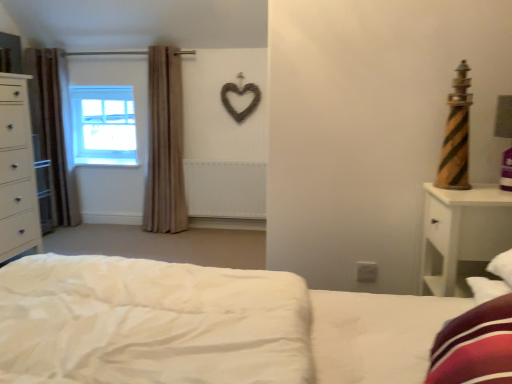
Question: Is white wood nightstand at right far away from beige fabric curtain at left, the second curtain positioned from the left?

Choices:
 (A) no
 (B) yes

Answer: (B)

Question: Does white wood nightstand at right appear on the right side of beige fabric curtain at left, the second curtain positioned from the left?

Choices:
 (A) no
 (B) yes

Answer: (B)

Question: Is the position of white wood nightstand at right more distant than that of beige fabric curtain at left, which ranks as the 1th curtain in right-to-left order?

Choices:
 (A) no
 (B) yes

Answer: (A)

Question: Is beige fabric curtain at left, which ranks as the 1th curtain in right-to-left order, surrounded by white wood nightstand at right?

Choices:
 (A) no
 (B) yes

Answer: (A)

Question: Can you confirm if white wood nightstand at right is shorter than beige fabric curtain at left, which ranks as the 1th curtain in right-to-left order?

Choices:
 (A) no
 (B) yes

Answer: (B)

Question: From the image's perspective, is white wood nightstand at right located above beige fabric curtain at left, the second curtain positioned from the left?

Choices:
 (A) yes
 (B) no

Answer: (B)

Question: Is clear glass window at upper left outside of beige fabric curtain at left, the second curtain positioned from the left?

Choices:
 (A) no
 (B) yes

Answer: (B)

Question: Does clear glass window at upper left turn towards beige fabric curtain at left, which ranks as the 1th curtain in right-to-left order?

Choices:
 (A) no
 (B) yes

Answer: (A)

Question: Is clear glass window at upper left surrounding beige fabric curtain at left, the second curtain positioned from the left?

Choices:
 (A) no
 (B) yes

Answer: (A)

Question: Considering the relative positions of clear glass window at upper left and beige fabric curtain at left, the second curtain positioned from the left, in the image provided, is clear glass window at upper left behind beige fabric curtain at left, the second curtain positioned from the left,?

Choices:
 (A) no
 (B) yes

Answer: (B)

Question: Is clear glass window at upper left at the left side of beige fabric curtain at left, which ranks as the 1th curtain in right-to-left order?

Choices:
 (A) yes
 (B) no

Answer: (A)

Question: Can you confirm if clear glass window at upper left is smaller than beige fabric curtain at left, which ranks as the 1th curtain in right-to-left order?

Choices:
 (A) no
 (B) yes

Answer: (B)

Question: Is beige fabric curtain at left, the second curtain positioned from the left, not inside brown fabric curtain at left, acting as the 1th curtain starting from the left?

Choices:
 (A) no
 (B) yes

Answer: (B)